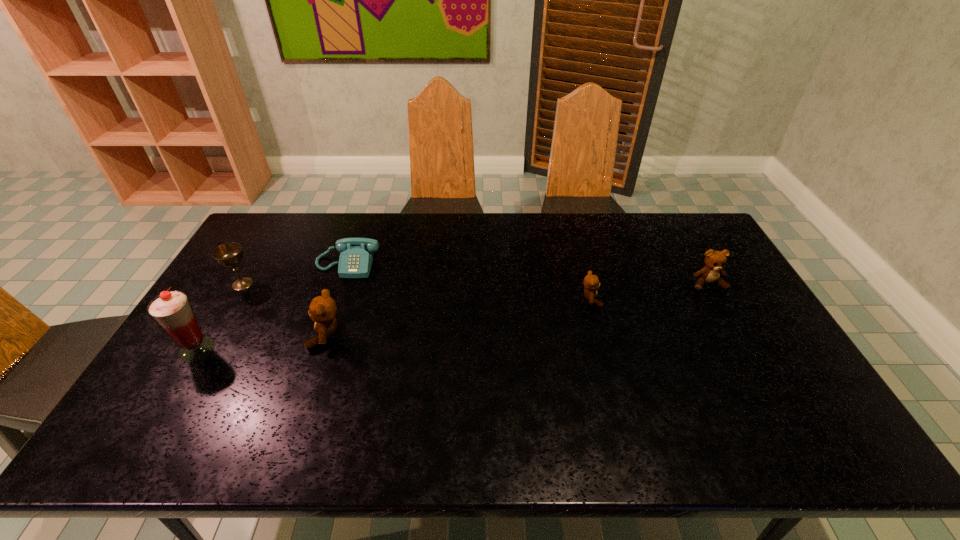
If we want them evenly spaced by inserting an extra teddy_bear among them, please locate a free spot for this new teddy_bear. Please provide its 2D coordinates. Your answer should be formatted as a tuple, i.e. [(x, y)], where the tuple contains the x and y coordinates of a point satisfying the conditions above.

[(464, 316)]